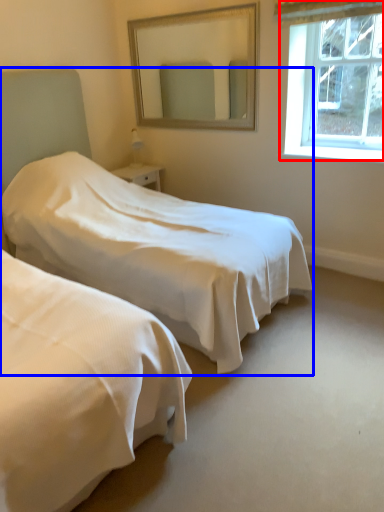
Question: Which of the following is the farthest to the observer, window (highlighted by a red box) or bed (highlighted by a blue box)?

Choices:
 (A) window
 (B) bed

Answer: (A)